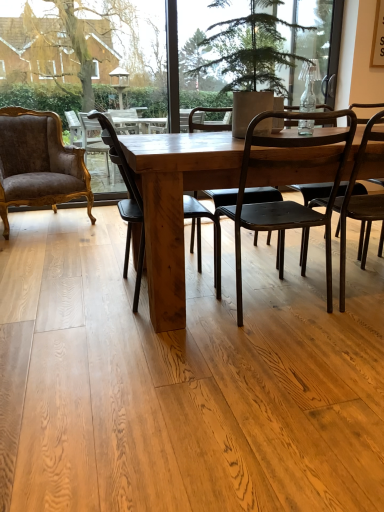
You are a GUI agent. You are given a task and a screenshot of the screen. Output one action in this format:
    pyautogui.click(x=<x>, y=<y>)
    Task: Click on the free point in front of matte black chair at center, acting as the 3th chair starting from the left
    
    Given the screenshot: What is the action you would take?
    pyautogui.click(x=281, y=357)